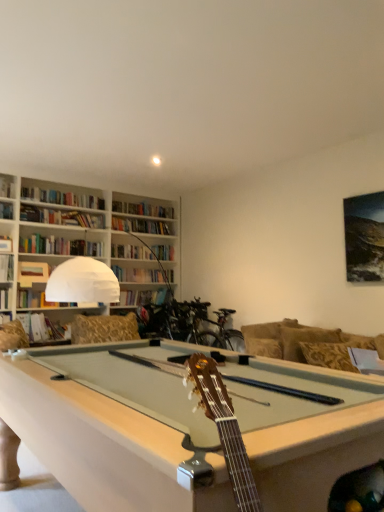
Question: Considering the relative positions of white fabric pillow at right and matte brown book at upper left, acting as the second book starting from the bottom, in the image provided, is white fabric pillow at right to the right of matte brown book at upper left, acting as the second book starting from the bottom, from the viewer's perspective?

Choices:
 (A) yes
 (B) no

Answer: (A)

Question: Does white fabric pillow at right have a larger size compared to matte brown book at upper left, placed as the 3th book when sorted from top to bottom?

Choices:
 (A) no
 (B) yes

Answer: (B)

Question: Does white fabric pillow at right come behind matte brown book at upper left, acting as the second book starting from the bottom?

Choices:
 (A) yes
 (B) no

Answer: (B)

Question: Can you confirm if white fabric pillow at right is positioned to the left of matte brown book at upper left, acting as the second book starting from the bottom?

Choices:
 (A) no
 (B) yes

Answer: (A)

Question: From a real-world perspective, is white fabric pillow at right on top of matte brown book at upper left, placed as the 3th book when sorted from top to bottom?

Choices:
 (A) no
 (B) yes

Answer: (A)

Question: From a real-world perspective, is white fabric pillow at right physically below matte brown book at upper left, acting as the second book starting from the bottom?

Choices:
 (A) yes
 (B) no

Answer: (A)

Question: Is hardcover book at upper left, which ranks as the first book in top-to-bottom order, closer to the viewer compared to matte brown book at upper left, acting as the second book starting from the bottom?

Choices:
 (A) yes
 (B) no

Answer: (A)

Question: Can you confirm if hardcover book at upper left, positioned as the fourth book in bottom-to-top order, is bigger than matte brown book at upper left, placed as the 3th book when sorted from top to bottom?

Choices:
 (A) yes
 (B) no

Answer: (A)

Question: Considering the relative sizes of hardcover book at upper left, which ranks as the first book in top-to-bottom order, and matte brown book at upper left, acting as the second book starting from the bottom, in the image provided, is hardcover book at upper left, which ranks as the first book in top-to-bottom order, shorter than matte brown book at upper left, acting as the second book starting from the bottom,?

Choices:
 (A) no
 (B) yes

Answer: (B)

Question: Can you confirm if hardcover book at upper left, positioned as the fourth book in bottom-to-top order, is wider than matte brown book at upper left, acting as the second book starting from the bottom?

Choices:
 (A) yes
 (B) no

Answer: (A)

Question: Is hardcover book at upper left, positioned as the fourth book in bottom-to-top order, not inside matte brown book at upper left, placed as the 3th book when sorted from top to bottom?

Choices:
 (A) no
 (B) yes

Answer: (B)

Question: From a real-world perspective, is hardcover book at upper left, which ranks as the first book in top-to-bottom order, below matte brown book at upper left, acting as the second book starting from the bottom?

Choices:
 (A) yes
 (B) no

Answer: (B)

Question: From the image's perspective, is gold-patterned fabric couch at right on hardcover book at left, positioned as the second book in top-to-bottom order?

Choices:
 (A) yes
 (B) no

Answer: (B)